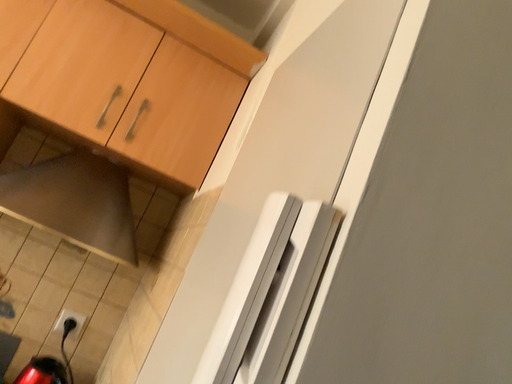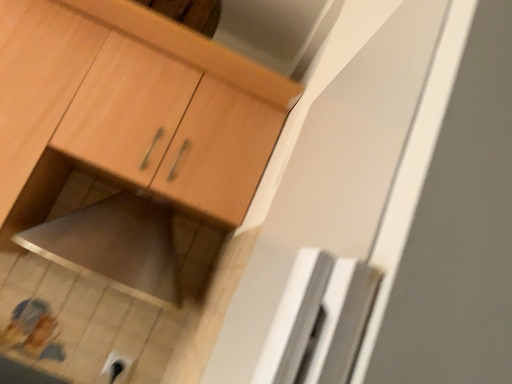
Question: Which way did the camera rotate in the video?

Choices:
 (A) rotated right
 (B) rotated left

Answer: (B)